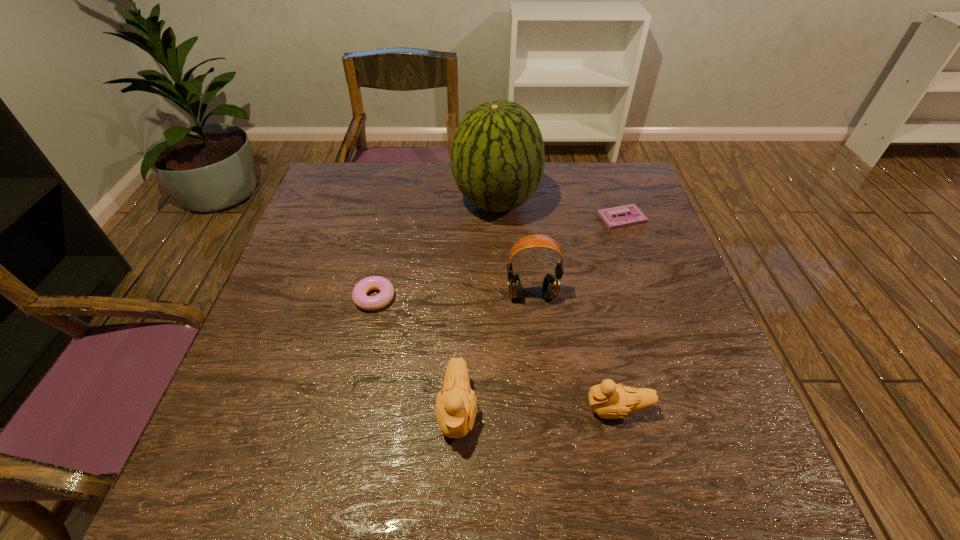
Find the location of `object that is at the far right corner`. object that is at the far right corner is located at coordinates (634, 216).

In the image, there is a desktop. Where is `vacant space at the far edge`? vacant space at the far edge is located at coordinates [451, 190].

Find the location of a particular element. free space at the left edge is located at coordinates (348, 266).

At what (x,y) coordinates should I click in order to perform the action: click on blank area at the right edge. Please return your answer as a coordinate pair (x, y). The height and width of the screenshot is (540, 960). Looking at the image, I should click on (674, 320).

I want to click on blank space at the far left corner, so click(319, 183).

Find the location of a particular element. free space at the far right corner is located at coordinates (615, 179).

You are a GUI agent. You are given a task and a screenshot of the screen. Output one action in this format:
    pyautogui.click(x=<x>, y=<y>)
    Task: Click on the vacant point located between the shorter duckling and the left duckling
    
    Given the screenshot: What is the action you would take?
    pyautogui.click(x=537, y=410)

You are a GUI agent. You are given a task and a screenshot of the screen. Output one action in this format:
    pyautogui.click(x=<x>, y=<y>)
    Task: Click on the vacant area that lies between the leftmost object and the fifth object from left to right
    The width and height of the screenshot is (960, 540).
    Given the screenshot: What is the action you would take?
    pyautogui.click(x=495, y=354)

Identify the location of unoccupied area between the second object from right to left and the tallest object. The width and height of the screenshot is (960, 540). (557, 306).

The height and width of the screenshot is (540, 960). I want to click on vacant point located between the watermelon and the second shortest object, so click(436, 249).